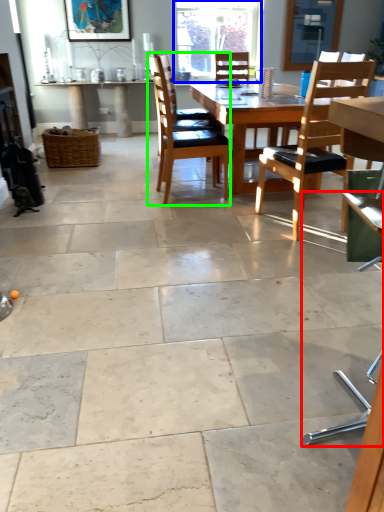
Question: Which is farther away from chair (highlighted by a red box)? window (highlighted by a blue box) or chair (highlighted by a green box)?

Choices:
 (A) window
 (B) chair

Answer: (A)